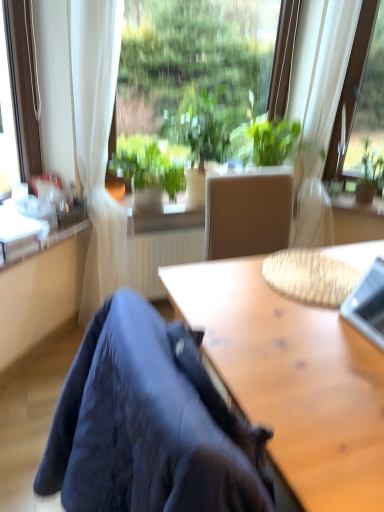
Question: Is transparent glass window at upper center, placed as the second window when sorted from right to left, situated inside white sheer curtain at upper center or outside?

Choices:
 (A) inside
 (B) outside

Answer: (B)

Question: Is point (127, 153) positioned closer to the camera than point (322, 167)?

Choices:
 (A) farther
 (B) closer

Answer: (B)

Question: Which object is positioned farthest from the wooden desk at lower right?

Choices:
 (A) transparent glass window at upper right, marked as the 2th window in a left-to-right arrangement
 (B) green leafy plant at center, which is the second houseplant in left-to-right order
 (C) green leafy plant at upper right, marked as the first houseplant in a right-to-left arrangement
 (D) green leafy plant at center, positioned as the 1th houseplant in left-to-right order
 (E) transparent glass window at upper center, the 1th window in the left-to-right sequence

Answer: (C)

Question: Estimate the real-world distances between objects in this image. Which object is farther from the white sheer curtain at upper center?

Choices:
 (A) silver metallic laptop at upper right
 (B) green leafy plant at center, positioned as the 1th houseplant in left-to-right order
 (C) transparent glass window at upper right, marked as the 2th window in a left-to-right arrangement
 (D) green leafy plant at center, which appears as the 2th houseplant when viewed from the right
 (E) green leafy plant at upper right, marked as the first houseplant in a right-to-left arrangement

Answer: (A)